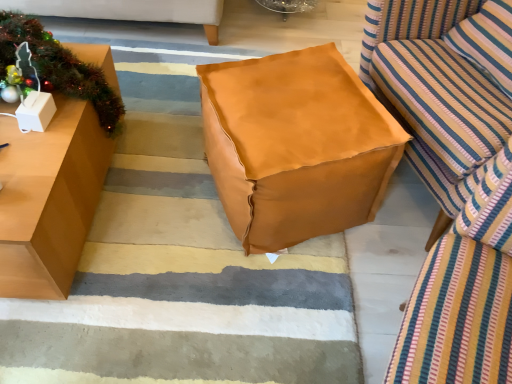
In order to click on free space in front of white cardboard box at left in this screenshot , I will do `click(27, 154)`.